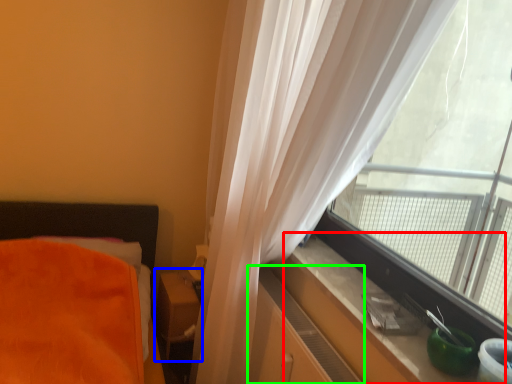
Question: Which object is the closest to the window sill (highlighted by a red box)? Choose among these: table (highlighted by a blue box) or dresser (highlighted by a green box).

Choices:
 (A) table
 (B) dresser

Answer: (B)